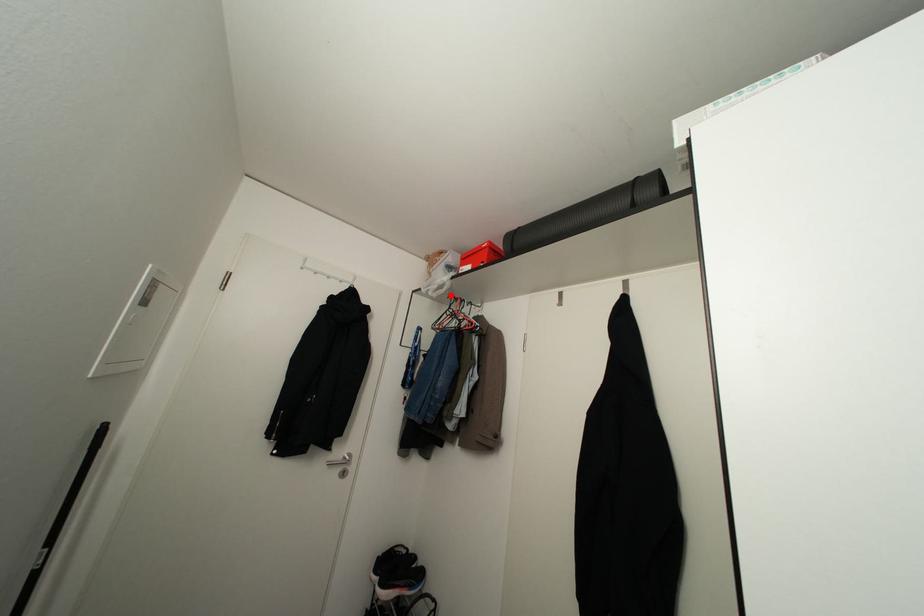
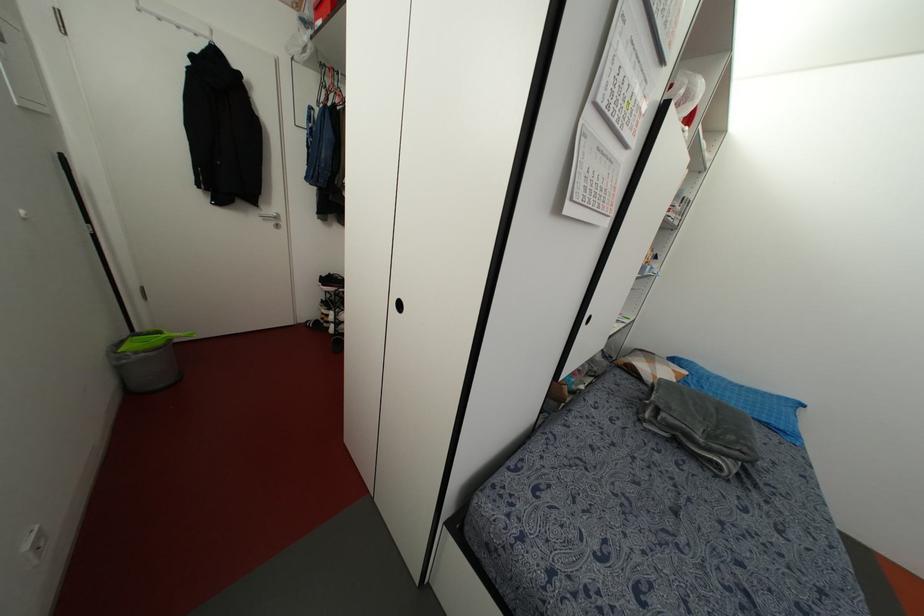
Locate, in the second image, the point that corresponds to the highlighted location in the first image.

(322, 63)